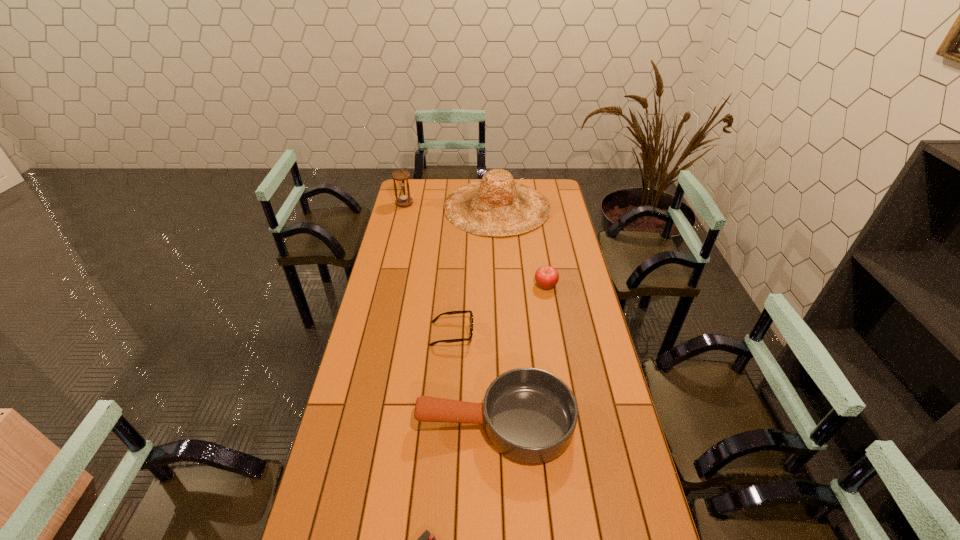
This screenshot has height=540, width=960. What are the coordinates of `sunhat` in the screenshot? It's located at (497, 205).

Locate an element on the screen. The height and width of the screenshot is (540, 960). the leftmost object is located at coordinates (401, 176).

At what (x,y) coordinates should I click in order to perform the action: click on the second nearest object. Please return your answer as a coordinate pair (x, y). Looking at the image, I should click on (529, 415).

The width and height of the screenshot is (960, 540). Identify the location of apple. (546, 277).

I want to click on the second shortest object, so click(466, 311).

I want to click on the third nearest object, so click(466, 311).

Find the location of `vacant space situated 0.070m on the left of the sunhat`. vacant space situated 0.070m on the left of the sunhat is located at coordinates (430, 207).

Where is `vacant point located 0.240m on the front of the hourglass`? This screenshot has height=540, width=960. vacant point located 0.240m on the front of the hourglass is located at coordinates (396, 235).

The height and width of the screenshot is (540, 960). In order to click on vacant area situated on the handle side of the pan in this screenshot , I will do `click(362, 422)`.

I want to click on vacant space located on the handle side of the pan, so click(374, 422).